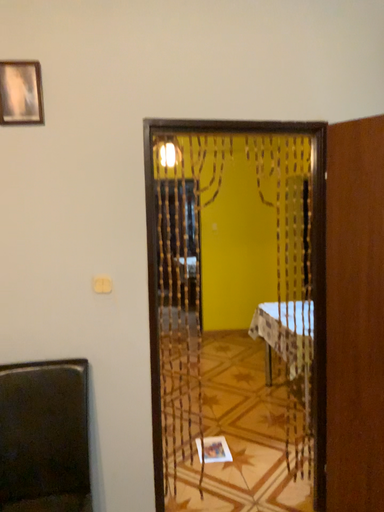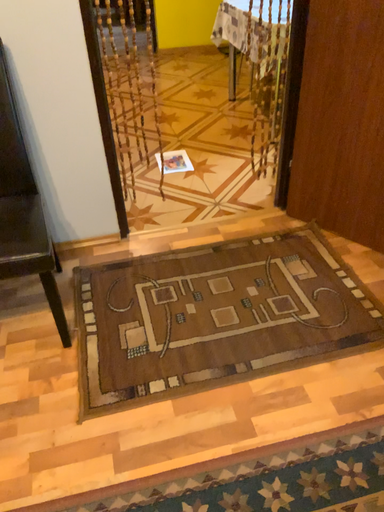
Question: Which way did the camera rotate in the video?

Choices:
 (A) rotated downward
 (B) rotated upward

Answer: (A)